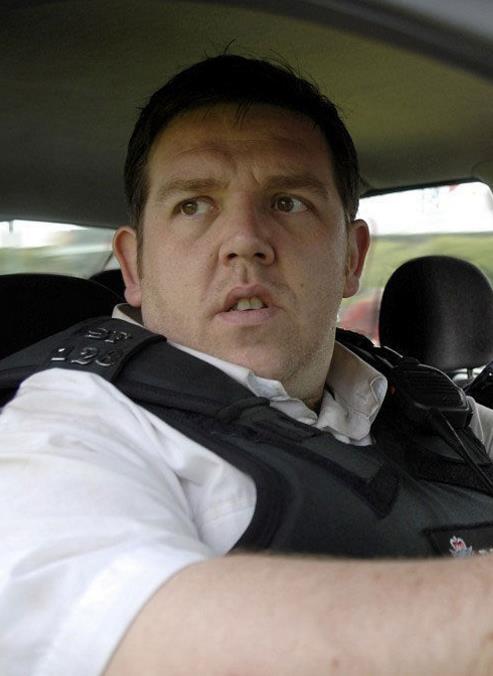
Where is `seat`? This screenshot has height=676, width=493. seat is located at coordinates (448, 318).